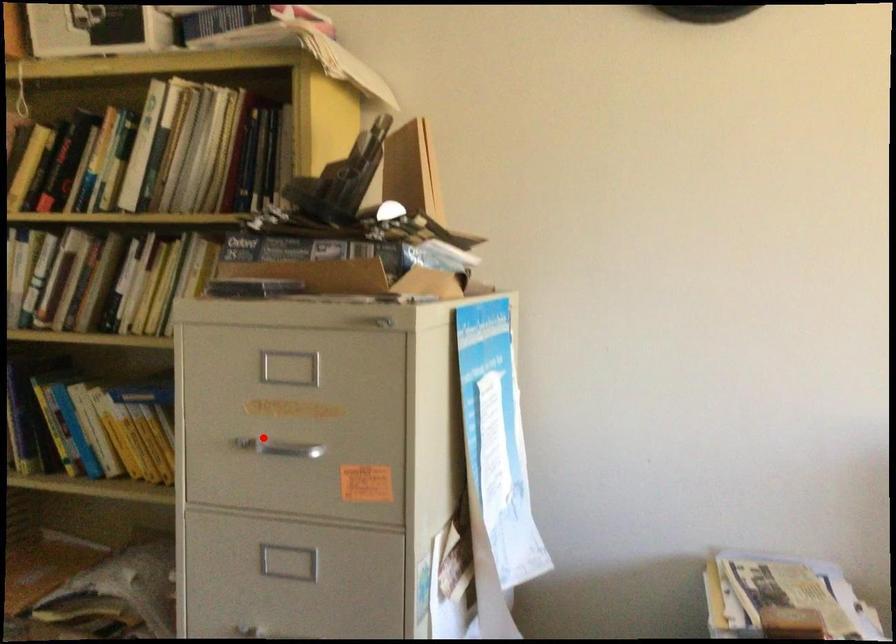
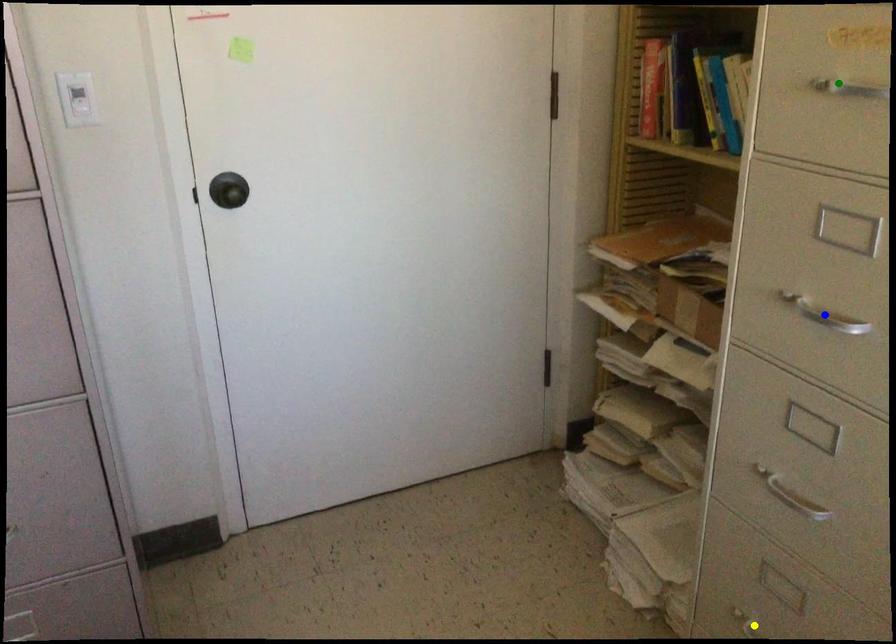
Question: I am providing you with two images of the same scene from different viewpoints. A red point is marked on the first image. You are given multiple points on the second image. Which point in image 2 is actually the same real-world point as the red point in image 1?

Choices:
 (A) yellow point
 (B) blue point
 (C) green point

Answer: (C)